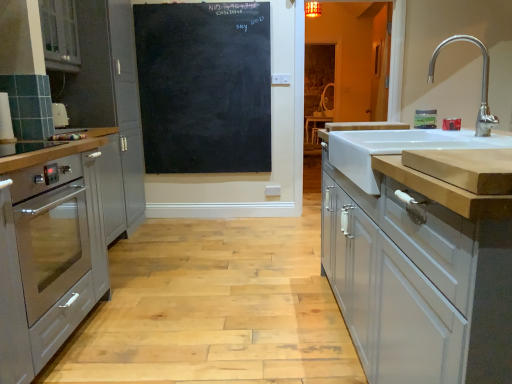
Image resolution: width=512 pixels, height=384 pixels. I want to click on free space above black chalkboard at center (from a real-world perspective), so click(x=197, y=2).